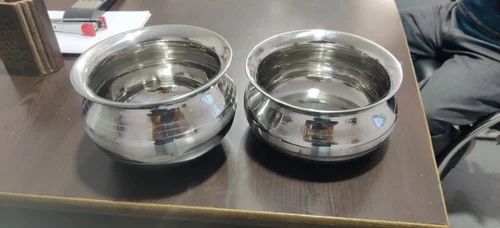
The height and width of the screenshot is (228, 500). Find the location of `side of table top`. side of table top is located at coordinates (27, 204), (91, 207), (225, 222).